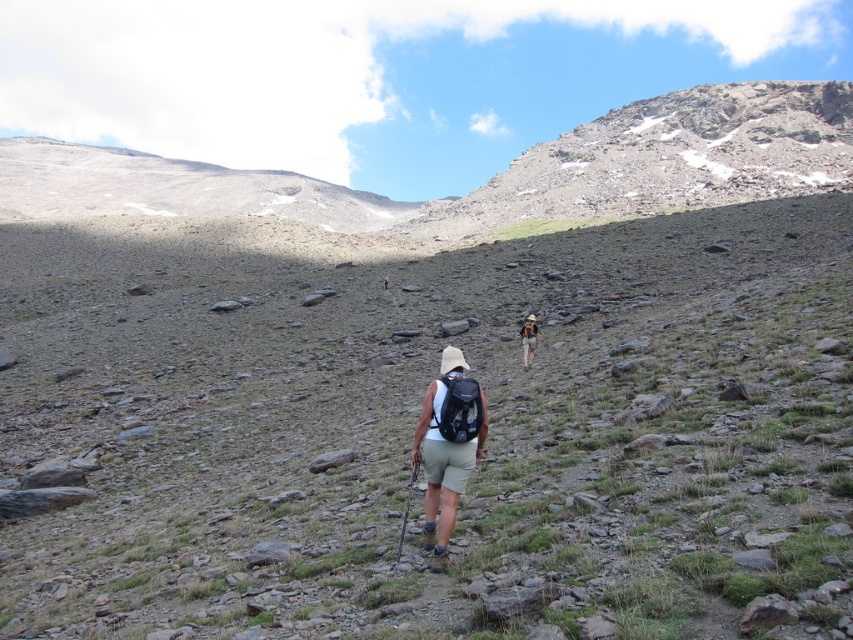
You are a hiker trying to follow the trail ahead. You notice two backpacks ahead of you on the path. Which backpack is closer to you, the camouflage fabric backpack at center or the matte black backpack at center?

The camouflage fabric backpack at center is closer to you since it is positioned in front of the matte black backpack at center.